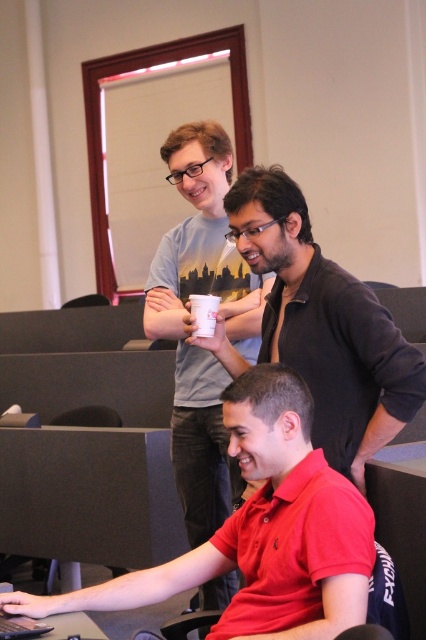
Is matte black shirt at upper center to the left of white paper cup at upper center from the viewer's perspective?

Incorrect, matte black shirt at upper center is not on the left side of white paper cup at upper center.

Does matte black shirt at upper center have a lesser width compared to white paper cup at upper center?

Incorrect, matte black shirt at upper center's width is not less than white paper cup at upper center's.

Does point (264, 321) lie in front of point (201, 337)?

That is True.

The height and width of the screenshot is (640, 426). Find the location of `matte black shirt at upper center`. matte black shirt at upper center is located at coordinates (325, 324).

Is matte black shirt at upper center taller than light gray t-shirt at center?

In fact, matte black shirt at upper center may be shorter than light gray t-shirt at center.

The height and width of the screenshot is (640, 426). Identify the location of matte black shirt at upper center. (325, 324).

At what (x,y) coordinates should I click in order to perform the action: click on matte black shirt at upper center. Please return your answer as a coordinate pair (x, y). Looking at the image, I should click on (325, 324).

From the picture: Can you confirm if matte black shirt at upper center is shorter than black matte laptop at lower left?

Incorrect, matte black shirt at upper center's height does not fall short of black matte laptop at lower left's.

Between point (359, 449) and point (8, 632), which one is positioned in front?

Point (8, 632)

Between point (368, 298) and point (11, 618), which one is positioned in front?

Positioned in front is point (11, 618).

You are a GUI agent. You are given a task and a screenshot of the screen. Output one action in this format:
    pyautogui.click(x=<x>, y=<y>)
    Task: Click on the matte black shirt at upper center
    This screenshot has height=640, width=426.
    Given the screenshot: What is the action you would take?
    pyautogui.click(x=325, y=324)